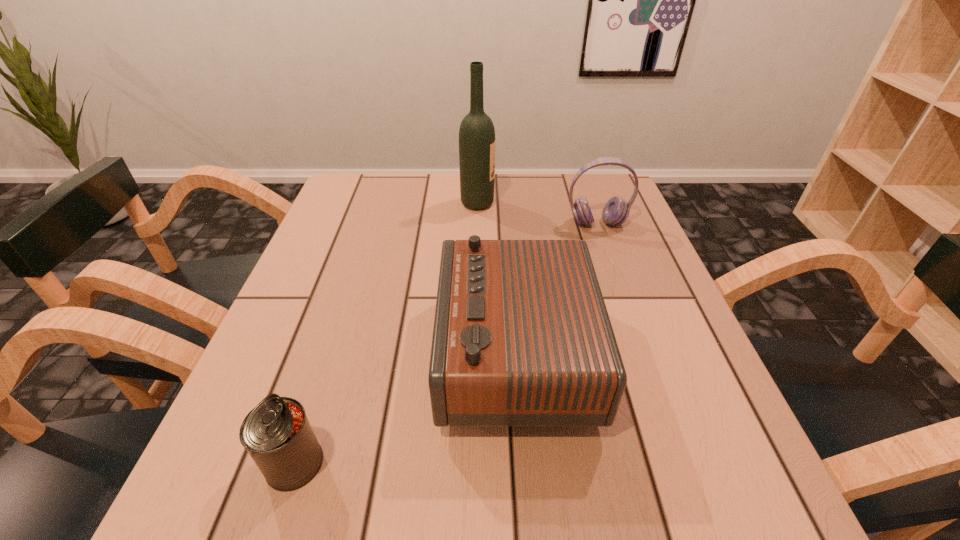
This screenshot has height=540, width=960. What are the coordinates of `vacant space at the far edge of the desktop` in the screenshot? It's located at (421, 198).

Locate an element on the screen. The image size is (960, 540). vacant space at the near edge is located at coordinates (516, 485).

In the image, there is a desktop. Where is `vacant region at the left edge`? The width and height of the screenshot is (960, 540). vacant region at the left edge is located at coordinates (320, 375).

This screenshot has height=540, width=960. In order to click on vacant area at the right edge of the desktop in this screenshot , I will do `click(593, 241)`.

Identify the location of vacant region at the far left corner of the desktop. (369, 198).

Locate an element on the screen. vacant space at the near right corner of the desktop is located at coordinates (737, 502).

Where is `unoccupied area between the can and the radio receiver`? The image size is (960, 540). unoccupied area between the can and the radio receiver is located at coordinates coord(405,408).

The width and height of the screenshot is (960, 540). I want to click on vacant area between the radio receiver and the shortest object, so click(405, 408).

Where is `unoccupied position between the headset and the wine bottle`? unoccupied position between the headset and the wine bottle is located at coordinates (538, 213).

You are a GUI agent. You are given a task and a screenshot of the screen. Output one action in this format:
    pyautogui.click(x=<x>, y=<y>)
    Task: Click on the free area in between the radio receiver and the can
    The image size is (960, 540).
    Given the screenshot: What is the action you would take?
    pyautogui.click(x=405, y=408)